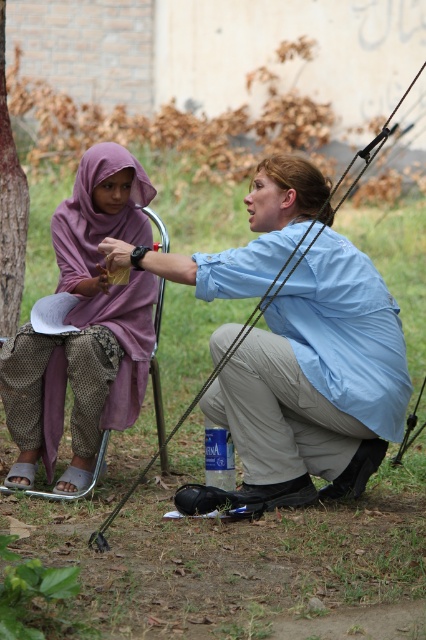
Question: Among these points, which one is farthest from the camera?

Choices:
 (A) (25, 362)
 (B) (6, 323)

Answer: (B)

Question: Does blue cotton shirt at center appear under brown rough bark at left?

Choices:
 (A) no
 (B) yes

Answer: (B)

Question: Does blue cotton shirt at center appear on the right side of purple fabric hijab at left?

Choices:
 (A) yes
 (B) no

Answer: (A)

Question: Which object is the closest to the brown rough bark at left?

Choices:
 (A) blue cotton shirt at center
 (B) purple fabric hijab at left

Answer: (B)

Question: Which point is farther to the camera?

Choices:
 (A) brown rough bark at left
 (B) purple fabric hijab at left
 (C) blue cotton shirt at center

Answer: (A)

Question: In this image, where is blue cotton shirt at center located relative to purple fabric hijab at left?

Choices:
 (A) below
 (B) above

Answer: (A)